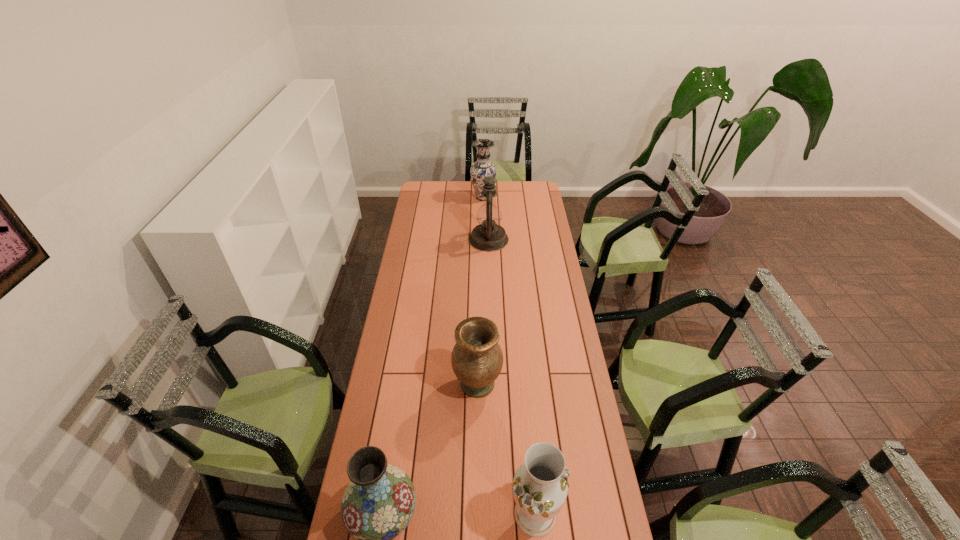
You are a GUI agent. You are given a task and a screenshot of the screen. Output one action in this format:
    pyautogui.click(x=<x>, y=<y>)
    Task: Click on the oil lamp
    The image size is (960, 540).
    Given the screenshot: What is the action you would take?
    pyautogui.click(x=488, y=236)

I want to click on the farthest vase, so click(480, 169).

What are the coordinates of `the third nearest vase` in the screenshot? It's located at click(x=477, y=359).

Locate an element on the screen. This screenshot has width=960, height=540. free space located 0.310m on the left of the second farthest object is located at coordinates (412, 240).

At what (x,y) coordinates should I click in order to perform the action: click on free location located 0.190m on the right of the farthest object. Please return your answer as a coordinate pair (x, y). The image size is (960, 540). Looking at the image, I should click on (526, 198).

Identify the location of free space located on the front of the third nearest object. (477, 494).

This screenshot has width=960, height=540. I want to click on object that is at the far edge, so click(x=480, y=169).

At what (x,y) coordinates should I click in order to perform the action: click on vacant region at the far edge. Please return your answer as a coordinate pair (x, y). Looking at the image, I should click on (501, 194).

In order to click on vacant area at the left edge in this screenshot , I will do `click(399, 317)`.

Where is `vacant region at the right edge of the desktop`? The width and height of the screenshot is (960, 540). vacant region at the right edge of the desktop is located at coordinates [x=568, y=313].